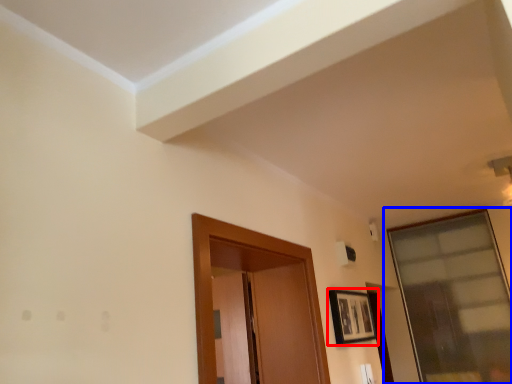
Question: Which object appears closest to the camera in this image, picture frame (highlighted by a red box) or window (highlighted by a blue box)?

Choices:
 (A) picture frame
 (B) window

Answer: (A)